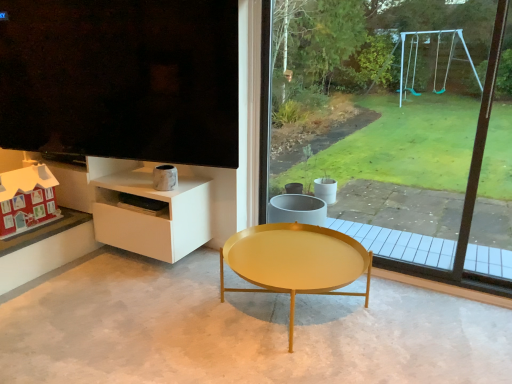
Image resolution: width=512 pixels, height=384 pixels. I want to click on free location to the right of gold metallic coffee table at center, so click(429, 324).